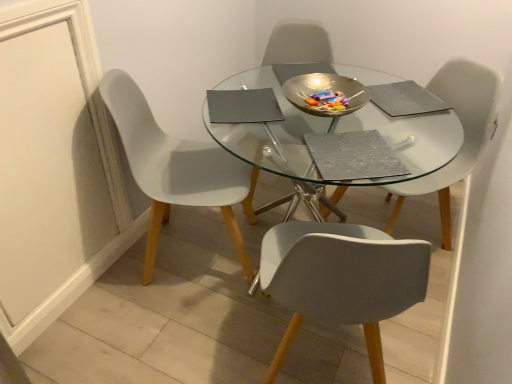
Question: Considering the relative positions of white plastic chair at left, positioned as the first chair in left-to-right order, and metallic silver chair at center, marked as the 2th chair in a left-to-right arrangement, in the image provided, is white plastic chair at left, positioned as the first chair in left-to-right order, in front of metallic silver chair at center, marked as the 2th chair in a left-to-right arrangement,?

Choices:
 (A) no
 (B) yes

Answer: (B)

Question: Would you say white plastic chair at left, positioned as the first chair in left-to-right order, contains metallic silver chair at center, which is the second chair from right to left?

Choices:
 (A) yes
 (B) no

Answer: (B)

Question: Is white plastic chair at left, placed as the 3th chair when sorted from right to left, positioned beyond the bounds of metallic silver chair at center, which is the second chair from right to left?

Choices:
 (A) no
 (B) yes

Answer: (B)

Question: Is metallic silver chair at center, marked as the 2th chair in a left-to-right arrangement, at the back of white plastic chair at left, placed as the 3th chair when sorted from right to left?

Choices:
 (A) no
 (B) yes

Answer: (A)

Question: Does white plastic chair at left, placed as the 3th chair when sorted from right to left, have a greater width compared to metallic silver chair at center, marked as the 2th chair in a left-to-right arrangement?

Choices:
 (A) yes
 (B) no

Answer: (A)

Question: In terms of width, does white plastic chair at center, which ranks as the third chair in left-to-right order, look wider or thinner when compared to metallic silver chair at center, marked as the 2th chair in a left-to-right arrangement?

Choices:
 (A) wide
 (B) thin

Answer: (B)

Question: Considering the positions of white plastic chair at center, which ranks as the third chair in left-to-right order, and metallic silver chair at center, which is the second chair from right to left, in the image, is white plastic chair at center, which ranks as the third chair in left-to-right order, taller or shorter than metallic silver chair at center, which is the second chair from right to left,?

Choices:
 (A) tall
 (B) short

Answer: (B)

Question: Visually, is white plastic chair at center, which is the first chair in right-to-left order, positioned to the left or to the right of metallic silver chair at center, which is the second chair from right to left?

Choices:
 (A) left
 (B) right

Answer: (B)

Question: Does point (484, 139) appear closer or farther from the camera than point (318, 57)?

Choices:
 (A) closer
 (B) farther

Answer: (A)

Question: From the image's perspective, is white plastic chair at left, placed as the 3th chair when sorted from right to left, above or below white plastic chair at center, which ranks as the third chair in left-to-right order?

Choices:
 (A) below
 (B) above

Answer: (A)

Question: In terms of height, does white plastic chair at left, positioned as the first chair in left-to-right order, look taller or shorter compared to white plastic chair at center, which ranks as the third chair in left-to-right order?

Choices:
 (A) tall
 (B) short

Answer: (A)

Question: Considering the relative positions of white plastic chair at left, positioned as the first chair in left-to-right order, and white plastic chair at center, which is the first chair in right-to-left order, in the image provided, is white plastic chair at left, positioned as the first chair in left-to-right order, to the left or to the right of white plastic chair at center, which is the first chair in right-to-left order,?

Choices:
 (A) left
 (B) right

Answer: (A)

Question: Is point (126, 142) positioned closer to the camera than point (479, 140)?

Choices:
 (A) farther
 (B) closer

Answer: (B)

Question: Is white plastic chair at center, which ranks as the third chair in left-to-right order, inside or outside of white plastic chair at left, placed as the 3th chair when sorted from right to left?

Choices:
 (A) inside
 (B) outside

Answer: (B)

Question: From the image's perspective, is white plastic chair at center, which ranks as the third chair in left-to-right order, above or below white plastic chair at left, placed as the 3th chair when sorted from right to left?

Choices:
 (A) above
 (B) below

Answer: (A)